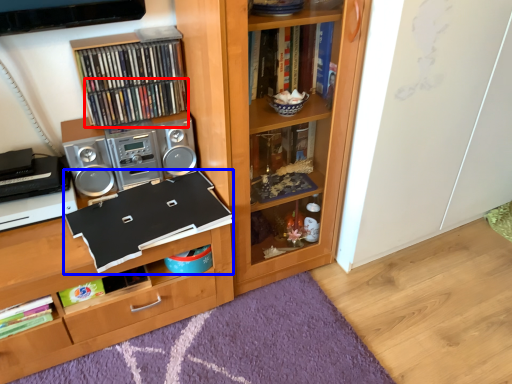
Question: Among these objects, which one is farthest to the camera, book (highlighted by a red box) or book (highlighted by a blue box)?

Choices:
 (A) book
 (B) book

Answer: (A)